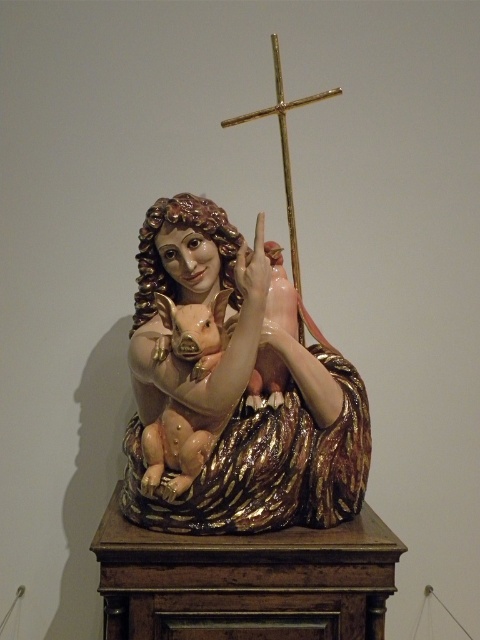
Question: Does glossy ceramic statue at center have a smaller size compared to gold polished cross at upper center?

Choices:
 (A) yes
 (B) no

Answer: (A)

Question: Which point is farther from the camera taking this photo?

Choices:
 (A) (225, 212)
 (B) (275, 109)

Answer: (A)

Question: Which point appears farthest from the camera in this image?

Choices:
 (A) (195, 509)
 (B) (225, 124)

Answer: (B)

Question: Is glossy ceramic statue at center positioned at the back of gold polished cross at upper center?

Choices:
 (A) yes
 (B) no

Answer: (B)

Question: Is glossy ceramic statue at center further to camera compared to gold polished cross at upper center?

Choices:
 (A) yes
 (B) no

Answer: (B)